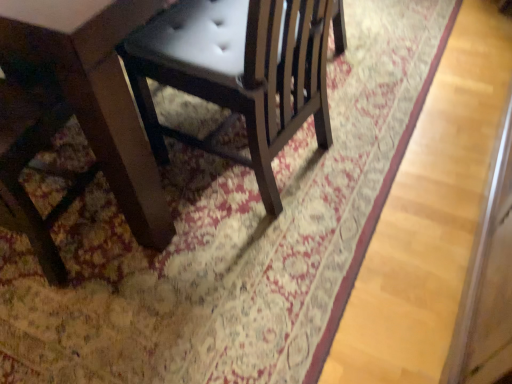
Question: From a real-world perspective, relative to wooden table at lower left, is matte black chair at center vertically above or below?

Choices:
 (A) below
 (B) above

Answer: (A)

Question: Based on their sizes in the image, would you say matte black chair at center is bigger or smaller than wooden table at lower left?

Choices:
 (A) small
 (B) big

Answer: (B)

Question: Choose the correct answer: Is matte black chair at center inside wooden table at lower left or outside it?

Choices:
 (A) outside
 (B) inside

Answer: (A)

Question: Is wooden table at lower left in front of or behind matte black chair at center in the image?

Choices:
 (A) behind
 (B) front

Answer: (B)

Question: From a real-world perspective, is wooden table at lower left above or below matte black chair at center?

Choices:
 (A) below
 (B) above

Answer: (B)

Question: Visually, is wooden table at lower left positioned to the left or to the right of matte black chair at center?

Choices:
 (A) right
 (B) left

Answer: (B)

Question: In terms of size, does wooden table at lower left appear bigger or smaller than matte black chair at center?

Choices:
 (A) small
 (B) big

Answer: (A)